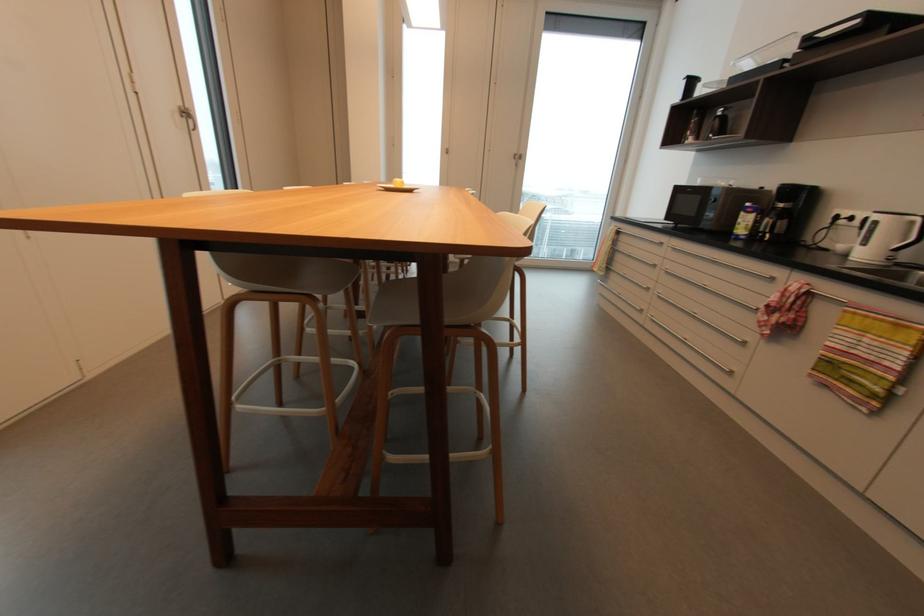
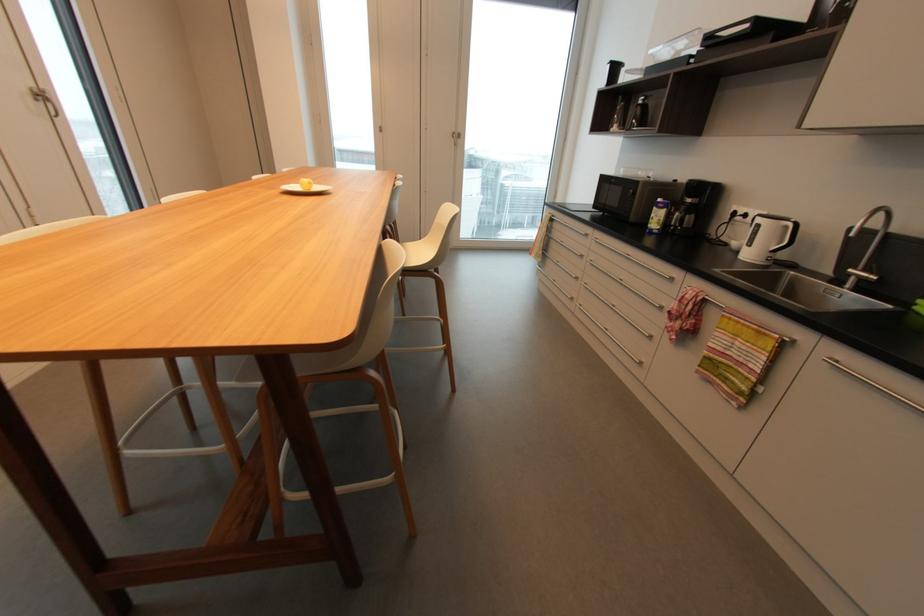
In the second image, find the point that corresponds to pixel 750 205 in the first image.

(663, 200)